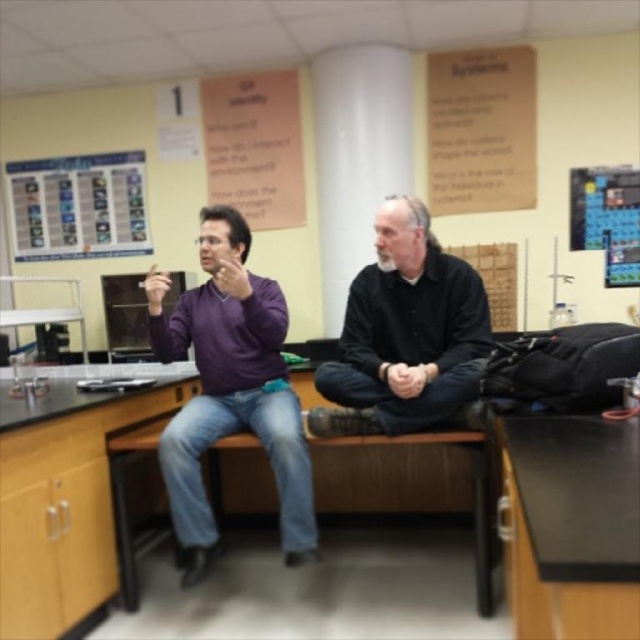
You are a student trying to determine which object is taller between the purple matte sweater at left and the metallic silver chart at upper left. Based on the scene provided, which one is taller?

The purple matte sweater at left is taller than the metallic silver chart at upper left according to the description.

You are standing in the classroom and want to locate the purple matte sweater at left. Which coordinate should you look at?

You should look at coordinate point (x=228, y=390) to find the purple matte sweater at left.

You have a rectangular object that is 2 meters long. You want to place it on either the black matte table at lower right or the black laminate counter top at center. Which surface can accommodate the object without overhanging?

The black laminate counter top at center has a greater width than the black matte table at lower right, so the rectangular object that is 2 meters long can be placed on the black laminate counter top at center without overhanging.